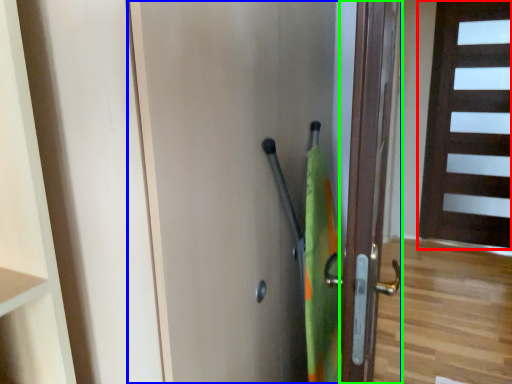
Question: Estimate the real-world distances between objects in this image. Which object is farther from door (highlighted by a red box), door (highlighted by a blue box) or door (highlighted by a green box)?

Choices:
 (A) door
 (B) door

Answer: (A)